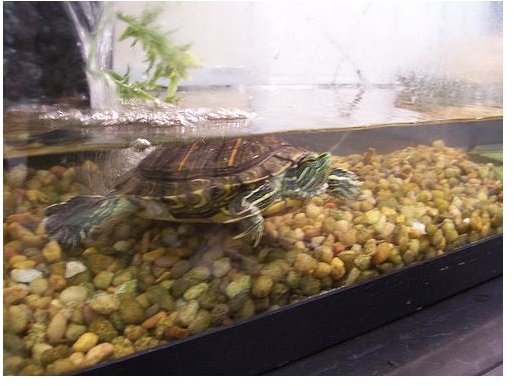
What are the coordinates of `green plants` in the screenshot? It's located at (160, 49), (133, 92).